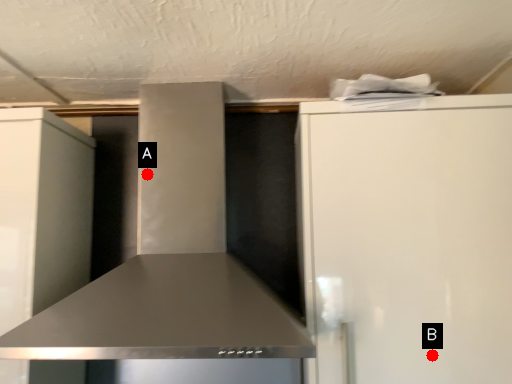
Question: Two points are circled on the image, labeled by A and B beside each circle. Which point is further to the camera?

Choices:
 (A) A is further
 (B) B is further

Answer: (A)